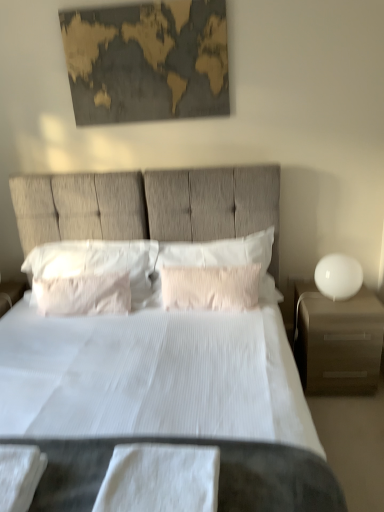
Image resolution: width=384 pixels, height=512 pixels. In order to click on free spot above white soft pillow at center, marked as the 3th pillow in a right-to-left arrangement (from a real-world perspective) in this screenshot , I will do `click(82, 273)`.